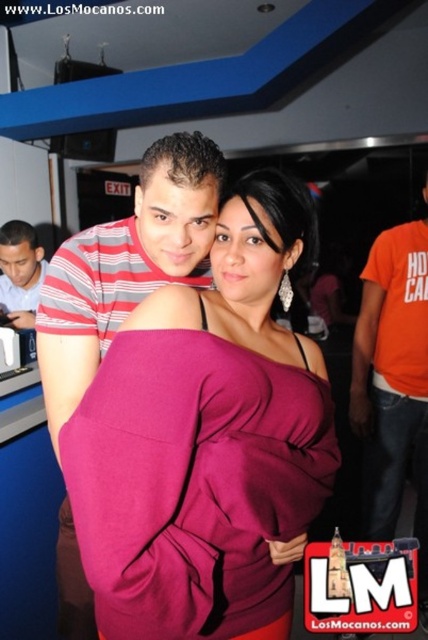
Which is behind, point (303, 422) or point (15, 257)?

Point (15, 257)

Which is more to the left, burgundy satin dress at center or striped cotton shirt at left?

From the viewer's perspective, striped cotton shirt at left appears more on the left side.

Where is `burgundy satin dress at center`? burgundy satin dress at center is located at coordinates (205, 440).

Is burgundy satin dress at center behind orange cotton t-shirt at right?

No, it is not.

The height and width of the screenshot is (640, 428). What are the coordinates of `burgundy satin dress at center` in the screenshot? It's located at (205, 440).

Locate an element on the screen. The image size is (428, 640). burgundy satin dress at center is located at coordinates (205, 440).

Consider the image. Does orange cotton t-shirt at right have a larger size compared to striped cotton shirt at left?

Indeed, orange cotton t-shirt at right has a larger size compared to striped cotton shirt at left.

Which is above, orange cotton t-shirt at right or striped cotton shirt at left?

Positioned higher is striped cotton shirt at left.

Measure the distance between point (415, 339) and camera.

A distance of 6.59 feet exists between point (415, 339) and camera.

Locate an element on the screen. This screenshot has height=640, width=428. orange cotton t-shirt at right is located at coordinates (394, 385).